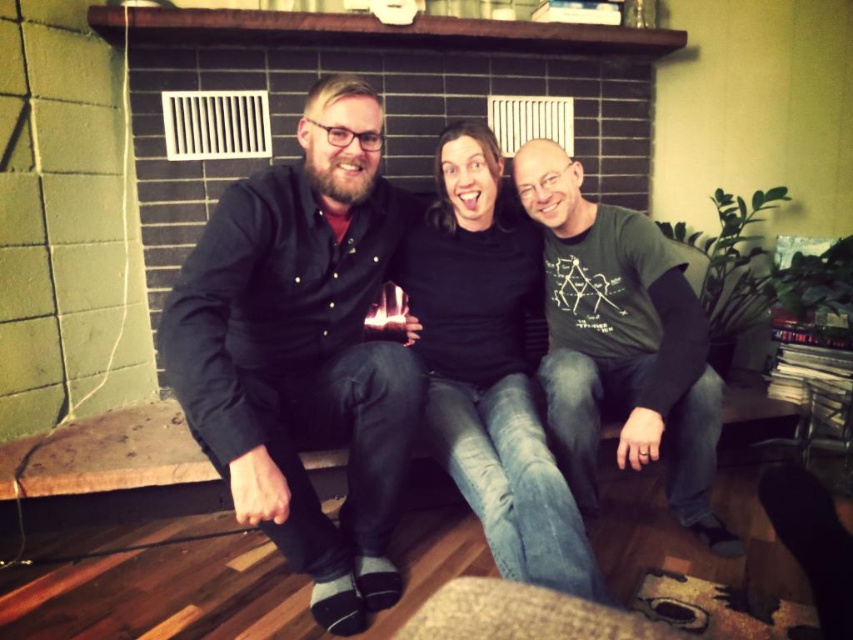
You are standing in the living room and want to place a small decorative item between the two points labeled point (364, 100) and point (672, 381). Which point should the item be placed closer to in order to appear larger to someone viewing the scene from your current position?

The item should be placed closer to point (364, 100) because it is closer to the camera, making objects placed there appear larger in the view.

In the scene shown: You are a photographer standing 1 meter away from the two people wearing black matte shirts. You want to take a photo of both of them without any part of their shirts being cut off. Given that your camera has a maximum field of view of 1.2 meters, will you be able to capture both the black matte shirt at left and the black matte shirt at center in a single shot?

The black matte shirt at left and black matte shirt at center are 33.47 centimeters apart from each other. Since the distance between them is less than the camera field of view of 1.2 meters, the photographer can capture both in a single shot.